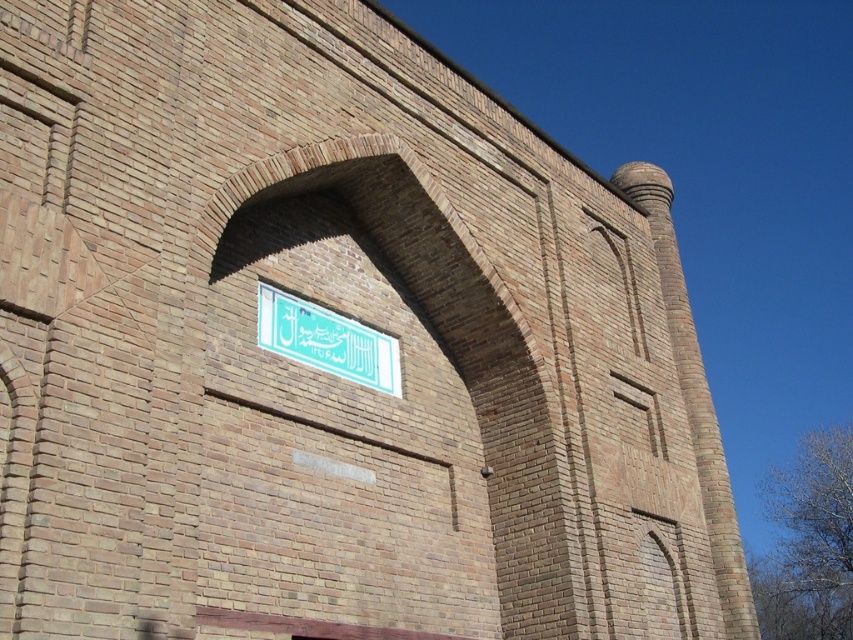
You are a painter standing 3 meters away from the brown brick archway at center. You want to paint the white glossy sign at center. Can you reach it with your 2.5 meter long pole?

The distance between the brown brick archway at center and the white glossy sign at center is 5.06 meters. Since you are already 3 meters away from the archway, the total distance to the sign is 5.06 meters. Your pole is only 2.5 meters long, so you cannot reach the sign.

You are an architect analyzing the brick structure. You notice two points marked on the image at coordinates point (537,384) and point (335,314). Based on the structure, which point is closer to the viewer?

Point (335,314) is closer to the viewer because it is in front of point (537,384).

From the picture: You are an architect designing a new building and want to install a sign similar to the white glossy sign at center inside an archway like the brown brick archway at center. Based on the scene, will the sign fit inside the archway?

The brown brick archway at center is bigger than the white glossy sign at center, so the sign will fit inside the archway.